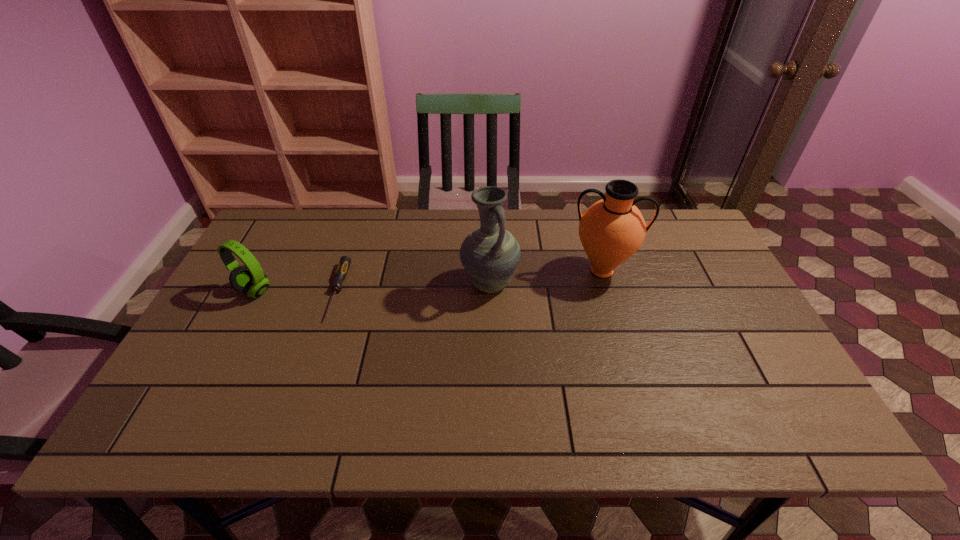
At what (x,y) coordinates should I click in order to perform the action: click on object located in the far edge section of the desktop. Please return your answer as a coordinate pair (x, y). The height and width of the screenshot is (540, 960). Looking at the image, I should click on (611, 230).

Locate an element on the screen. object positioned at the left edge is located at coordinates (249, 278).

Where is `vacant region at the far edge of the desktop`? The image size is (960, 540). vacant region at the far edge of the desktop is located at coordinates (344, 223).

Find the location of a particular element. The width and height of the screenshot is (960, 540). free space at the near edge of the desktop is located at coordinates (321, 413).

Identify the location of free location at the left edge of the desktop. (217, 391).

Where is `free spot at the far left corner of the desktop`? The width and height of the screenshot is (960, 540). free spot at the far left corner of the desktop is located at coordinates (278, 224).

Where is `blank space at the far right corner`? blank space at the far right corner is located at coordinates (699, 240).

At what (x,y) coordinates should I click in order to perform the action: click on vacant area between the second object from right to left and the third tallest object. Please return your answer as a coordinate pair (x, y). Looking at the image, I should click on (372, 287).

Image resolution: width=960 pixels, height=540 pixels. I want to click on vacant space that's between the third tallest object and the rightmost object, so click(428, 281).

Where is `free space between the second object from right to left and the second object from left to right`? The height and width of the screenshot is (540, 960). free space between the second object from right to left and the second object from left to right is located at coordinates (414, 287).